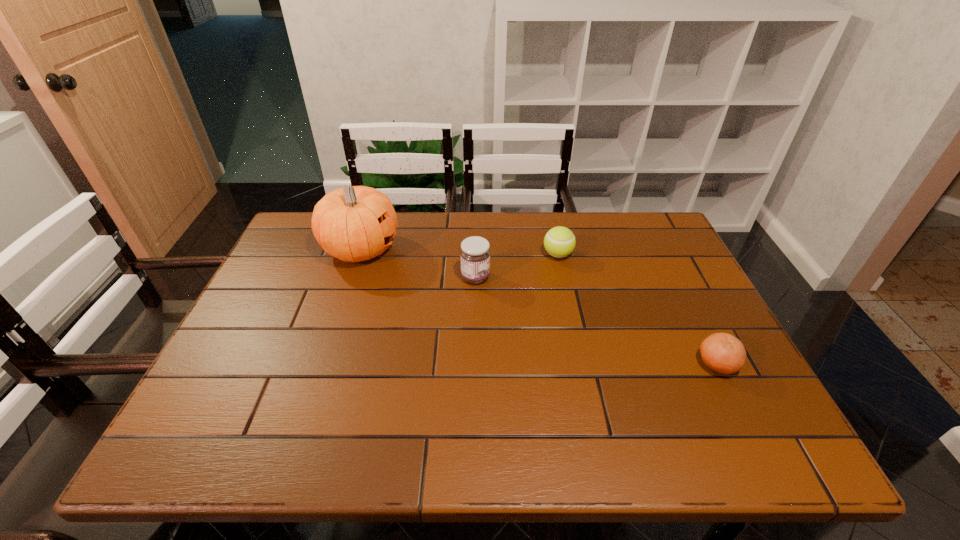
At what (x,y) coordinates should I click in order to perform the action: click on the leftmost object. Please return your answer as a coordinate pair (x, y). Looking at the image, I should click on (354, 223).

Where is `pumpkin`? This screenshot has width=960, height=540. pumpkin is located at coordinates (354, 223).

This screenshot has width=960, height=540. I want to click on jam, so click(475, 253).

The image size is (960, 540). Identify the location of the third object from right to left. (475, 253).

Find the location of a particular element. Image resolution: width=960 pixels, height=540 pixels. tennis ball is located at coordinates (559, 242).

Find the location of a particular element. The width and height of the screenshot is (960, 540). the third tallest object is located at coordinates pos(559,242).

The image size is (960, 540). In order to click on the rightmost object in this screenshot , I will do `click(723, 353)`.

The image size is (960, 540). I want to click on the nearest object, so click(723, 353).

Locate an element on the screen. blank space located on the front-facing side of the pumpkin is located at coordinates (531, 249).

The height and width of the screenshot is (540, 960). What are the coordinates of `vacant space located 0.050m on the front label of the third object from right to left` in the screenshot? It's located at [508, 278].